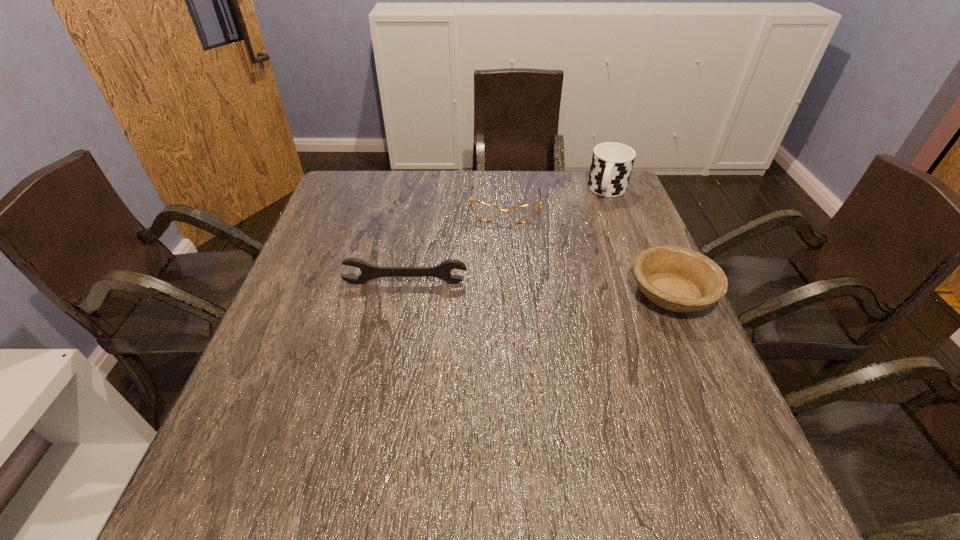
The height and width of the screenshot is (540, 960). Find the location of `vacant area at the right edge`. vacant area at the right edge is located at coordinates (673, 370).

This screenshot has height=540, width=960. In order to click on vacant area at the far left corner of the desktop in this screenshot , I will do `click(341, 184)`.

Find the location of a particular element. This screenshot has width=960, height=540. blank space at the far right corner of the desktop is located at coordinates (583, 202).

This screenshot has width=960, height=540. Identify the location of vacant space at the near right corner of the desktop. (708, 433).

This screenshot has width=960, height=540. I want to click on vacant space that's between the spectacles and the wrench, so 455,245.

Where is `vacant area between the wrench and the bowl`? The image size is (960, 540). vacant area between the wrench and the bowl is located at coordinates (539, 288).

Where is `vacant point located between the wrench and the spectacles`? This screenshot has height=540, width=960. vacant point located between the wrench and the spectacles is located at coordinates (455, 245).

Image resolution: width=960 pixels, height=540 pixels. Find the location of `vacant space that's between the wrench and the spectacles`. vacant space that's between the wrench and the spectacles is located at coordinates (455, 245).

Locate an element on the screen. The width and height of the screenshot is (960, 540). vacant area that lies between the bowl and the spectacles is located at coordinates (588, 249).

You are a GUI agent. You are given a task and a screenshot of the screen. Output one action in this format:
    pyautogui.click(x=<x>, y=<y>)
    Task: Click on the free space between the wrench and the tallest object
    This screenshot has width=960, height=540.
    Given the screenshot: What is the action you would take?
    pyautogui.click(x=507, y=237)